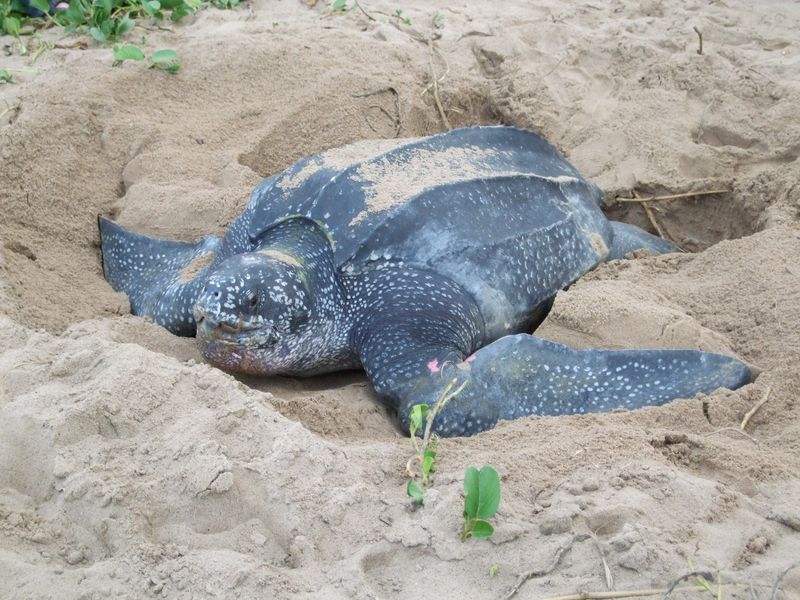
In order to click on left front leg in this screenshot , I will do (x=474, y=383).